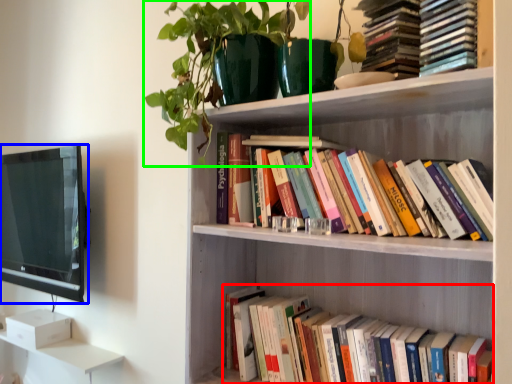
Question: Estimate the real-world distances between objects in this image. Which object is closer to book (highlighted by a red box), television (highlighted by a blue box) or plant (highlighted by a green box)?

Choices:
 (A) television
 (B) plant

Answer: (B)